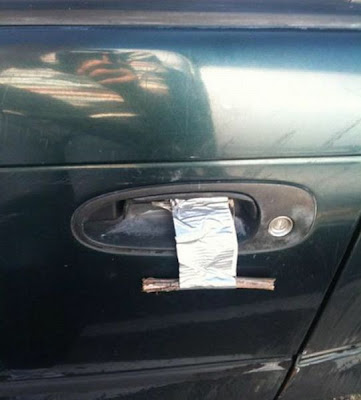
Where is `handle`? This screenshot has width=361, height=400. handle is located at coordinates (267, 205).